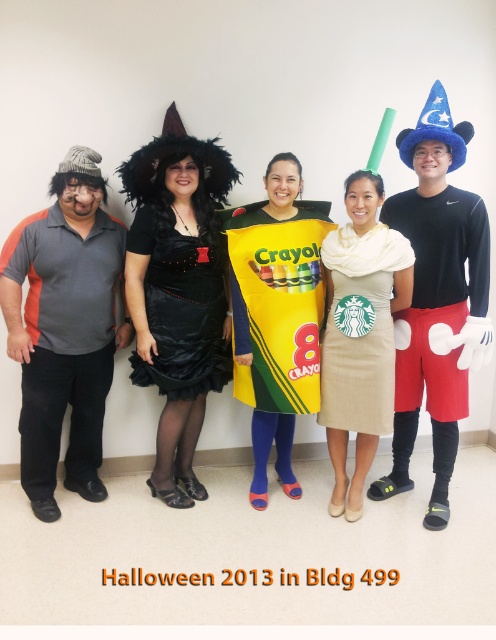
Consider the image. Based on the scene description, can you determine which of the two costumes, the gray matte shirt at left or the black satin dress at center, is wider?

The gray matte shirt at left is wider than the black satin dress at center according to the description.

You are organizing a Halloween costume party and need to arrange two dresses in the center of the room. The velvet black dress at center and the beige textured dress at center. Given their sizes, which dress should be placed first to ensure both fit comfortably?

The beige textured dress at center should be placed first because the velvet black dress at center is wider, so positioning the narrower one first allows more flexibility for arranging the larger dress afterward.

You are standing in front of the Halloween photo. You want to move closer to the velvet black dress at center without moving past it. Which direction should you move to avoid passing the blue felt hat at upper right?

Since the velvet black dress at center is closer to you than the blue felt hat at upper right, you should move forward towards the velvet black dress at center. This way, you won